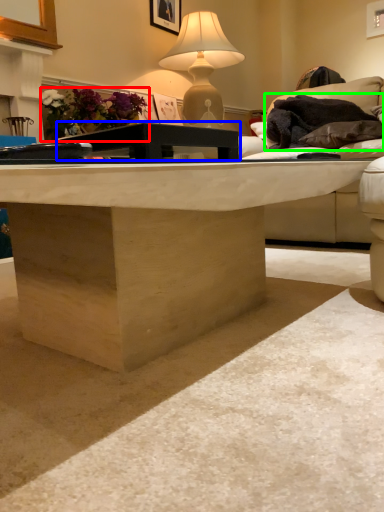
Question: Based on their relative distances, which object is farther from flower (highlighted by a red box)? Choose from table (highlighted by a blue box) and material (highlighted by a green box).

Choices:
 (A) table
 (B) material

Answer: (A)